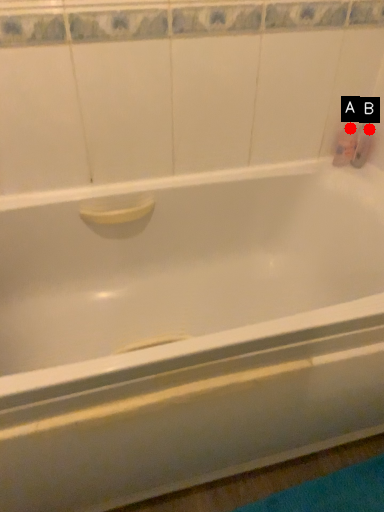
Question: Two points are circled on the image, labeled by A and B beside each circle. Which point is closer to the camera taking this photo?

Choices:
 (A) A is closer
 (B) B is closer

Answer: (A)